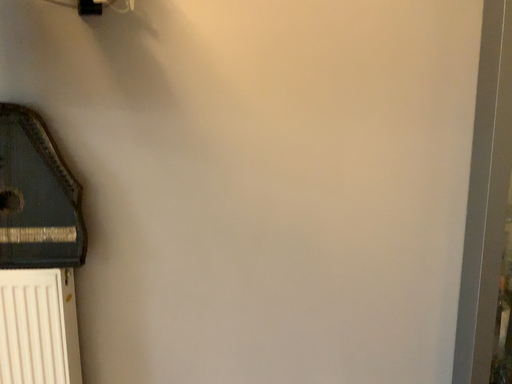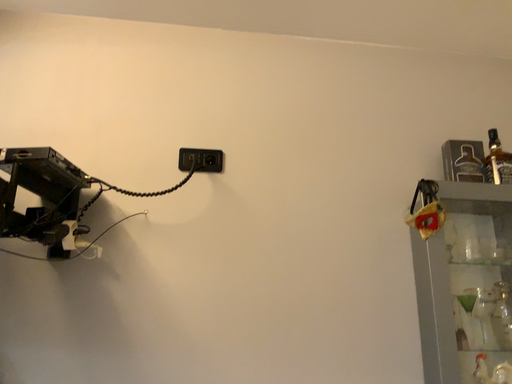
Question: Which way did the camera rotate in the video?

Choices:
 (A) rotated upward
 (B) rotated downward

Answer: (A)